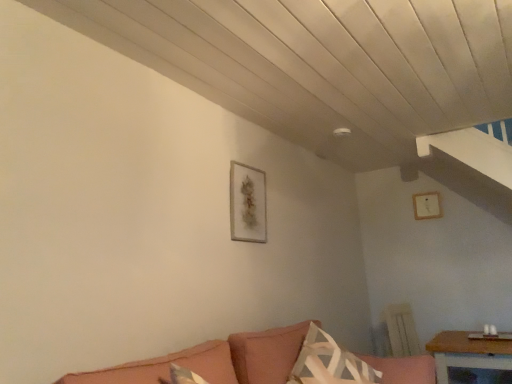
Question: Can you confirm if wooden table at lower right is thinner than white textured pillow at lower center?

Choices:
 (A) no
 (B) yes

Answer: (A)

Question: From the image's perspective, does wooden table at lower right appear higher than white textured pillow at lower center?

Choices:
 (A) no
 (B) yes

Answer: (A)

Question: From a real-world perspective, is wooden table at lower right beneath white textured pillow at lower center?

Choices:
 (A) yes
 (B) no

Answer: (A)

Question: Can you confirm if wooden table at lower right is wider than white textured pillow at lower center?

Choices:
 (A) yes
 (B) no

Answer: (A)

Question: Is wooden table at lower right behind white textured pillow at lower center?

Choices:
 (A) yes
 (B) no

Answer: (A)

Question: Is wooden table at lower right at the left side of white textured pillow at lower center?

Choices:
 (A) yes
 (B) no

Answer: (B)

Question: Could you tell me if matte gold picture frame at center, marked as the first picture frame in a front-to-back arrangement, is facing wooden table at lower right?

Choices:
 (A) no
 (B) yes

Answer: (A)

Question: Can you confirm if matte gold picture frame at center, which ranks as the 2th picture frame in back-to-front order, is wider than wooden table at lower right?

Choices:
 (A) yes
 (B) no

Answer: (B)

Question: From the image's perspective, is matte gold picture frame at center, the second picture frame when ordered from right to left, under wooden table at lower right?

Choices:
 (A) no
 (B) yes

Answer: (A)

Question: Considering the relative sizes of matte gold picture frame at center, which is counted as the first picture frame, starting from the left, and wooden table at lower right in the image provided, is matte gold picture frame at center, which is counted as the first picture frame, starting from the left, bigger than wooden table at lower right?

Choices:
 (A) no
 (B) yes

Answer: (A)

Question: Considering the relative sizes of matte gold picture frame at center, which ranks as the 2th picture frame in back-to-front order, and wooden table at lower right in the image provided, is matte gold picture frame at center, which ranks as the 2th picture frame in back-to-front order, smaller than wooden table at lower right?

Choices:
 (A) no
 (B) yes

Answer: (B)

Question: Is matte gold picture frame at center, which ranks as the 2th picture frame in back-to-front order, far away from wooden table at lower right?

Choices:
 (A) no
 (B) yes

Answer: (B)

Question: Can you confirm if velvet pink couch at lower center is shorter than white textured pillow at lower center?

Choices:
 (A) no
 (B) yes

Answer: (A)